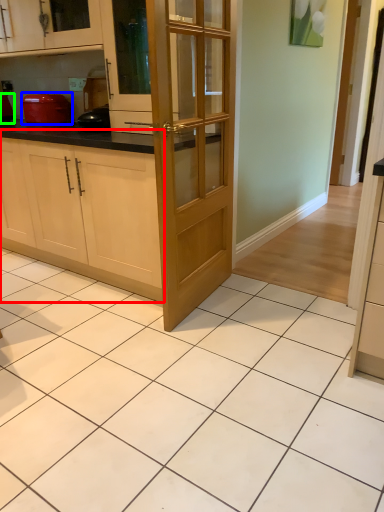
Question: Estimate the real-world distances between objects in this image. Which object is closer to cabinetry (highlighted by a red box), kitchen appliance (highlighted by a blue box) or appliance (highlighted by a green box)?

Choices:
 (A) kitchen appliance
 (B) appliance

Answer: (A)